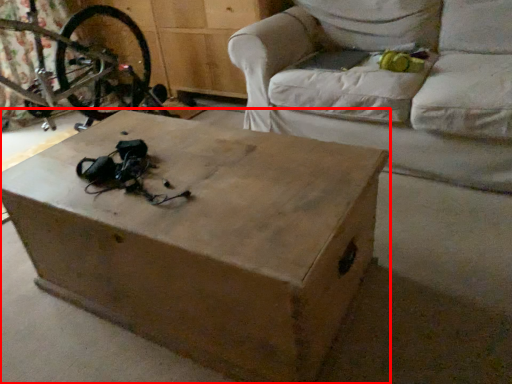
Question: From the image's perspective, what is the correct spatial relationship of table (annotated by the red box) in relation to studio couch?

Choices:
 (A) above
 (B) below

Answer: (B)